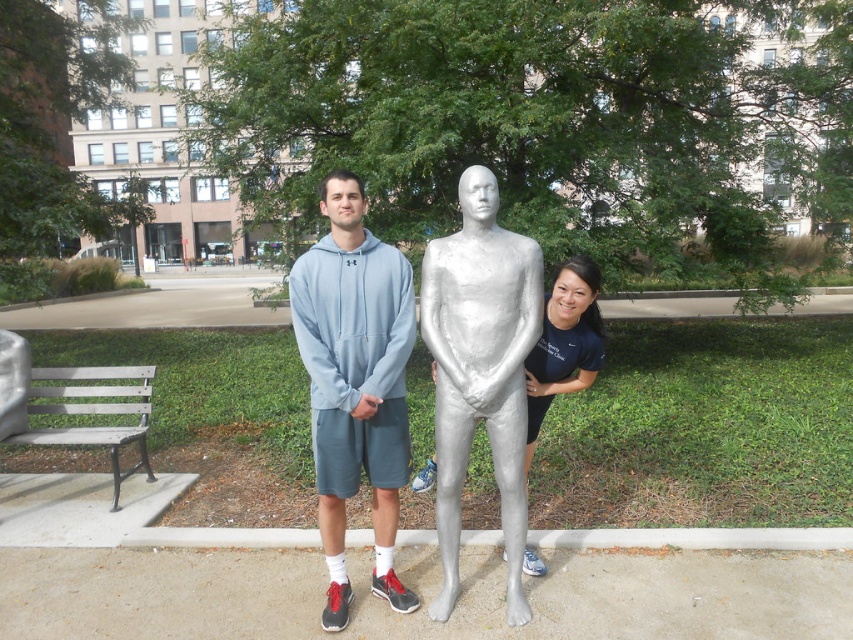
Question: Which point is farther to the camera?

Choices:
 (A) (448, 280)
 (B) (490, 252)

Answer: (B)

Question: Which of these objects is positioned farthest from the wooden slats bench at lower left?

Choices:
 (A) silver metallic mannequin at center
 (B) silver metallic statue at center
 (C) metallic silver figure at center
 (D) light blue hoodie at center

Answer: (C)

Question: Is silver metallic statue at center behind metallic silver figure at center?

Choices:
 (A) no
 (B) yes

Answer: (A)

Question: Which point appears farthest from the camera in this image?

Choices:
 (A) pyautogui.click(x=450, y=253)
 (B) pyautogui.click(x=585, y=317)
 (C) pyautogui.click(x=117, y=387)
 (D) pyautogui.click(x=508, y=513)

Answer: (C)

Question: Does light blue hoodie at center appear under wooden slats bench at lower left?

Choices:
 (A) no
 (B) yes

Answer: (A)

Question: Considering the relative positions of light blue hoodie at center and metallic silver figure at center in the image provided, where is light blue hoodie at center located with respect to metallic silver figure at center?

Choices:
 (A) below
 (B) above

Answer: (A)